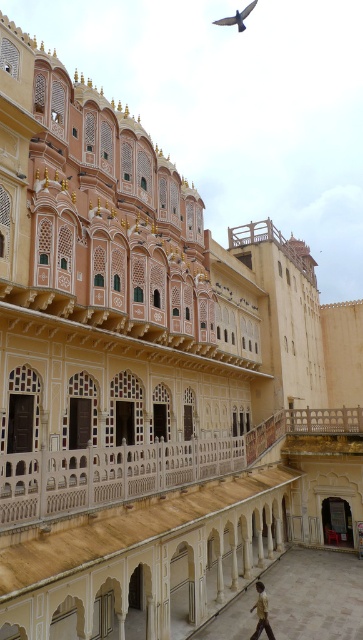
You are standing in front of the grand architectural structure and notice a point marked at coordinates (262, 612). Based on the scene description, where is this point located?

The point is located on the brown textured shirt at lower center.

You are an architect analyzing the symmetry of the building. You notice the brown textured shirt at lower center and the dark gray feathered bird at upper center. Which object appears narrower when viewed from your perspective?

The brown textured shirt at lower center appears narrower because it has a lesser width compared to the dark gray feathered bird at upper center.